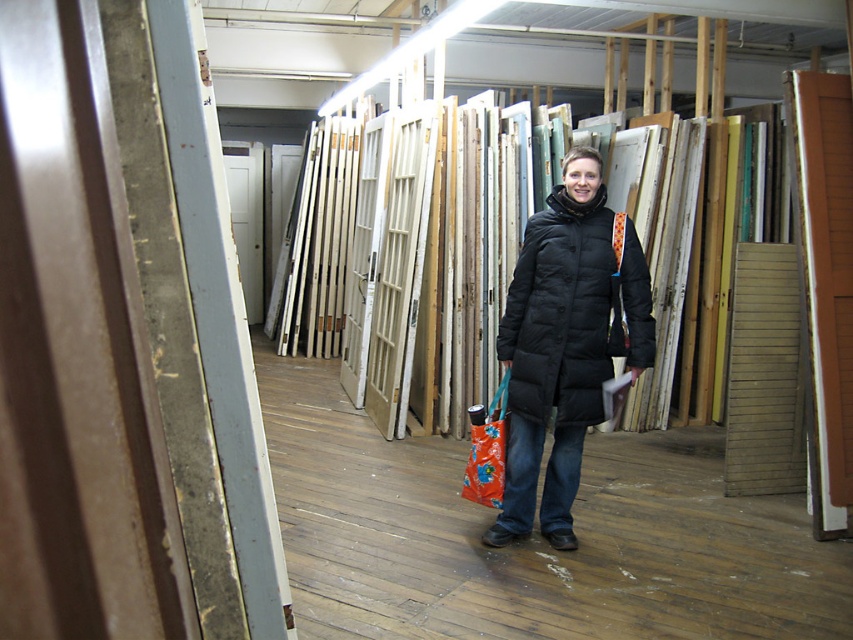
Can you confirm if black quilted coat at center is positioned above orange fabric shopping bag at center?

Correct, black quilted coat at center is located above orange fabric shopping bag at center.

The height and width of the screenshot is (640, 853). I want to click on black quilted coat at center, so click(566, 342).

The height and width of the screenshot is (640, 853). What are the coordinates of `black quilted coat at center` in the screenshot? It's located at (566, 342).